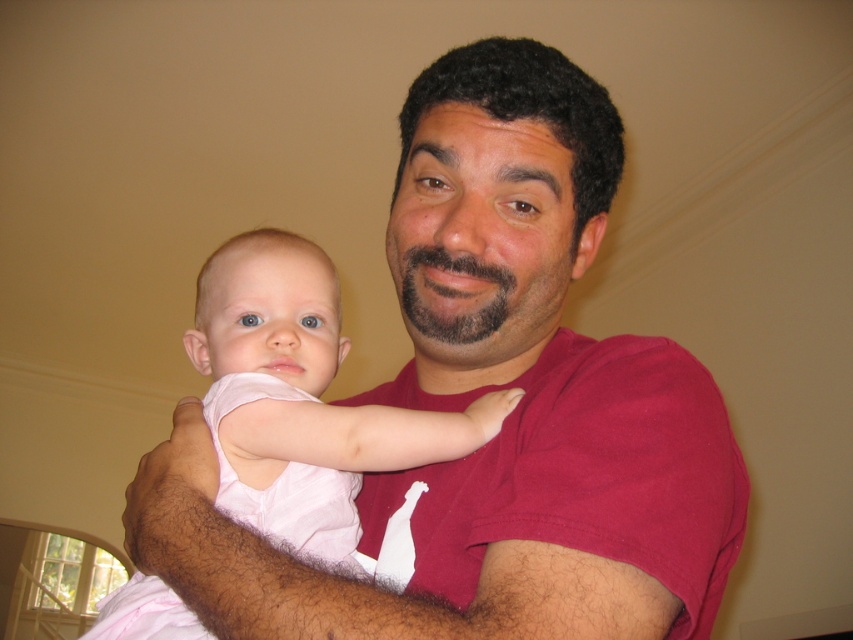
Does pink fabric at center have a greater width compared to pink fabric baby at center?

Indeed, pink fabric at center has a greater width compared to pink fabric baby at center.

Can you confirm if pink fabric at center is bigger than pink fabric baby at center?

Correct, pink fabric at center is larger in size than pink fabric baby at center.

Is point (463, 522) more distant than point (433, 422)?

No.

Where is `pink fabric at center`? pink fabric at center is located at coordinates (482, 502).

Does point (456, 154) come in front of point (265, 589)?

No, (456, 154) is behind (265, 589).

Can you confirm if matte red shirt at center is taller than pink fabric at center?

Yes, matte red shirt at center is taller than pink fabric at center.

Which is behind, point (392, 385) or point (500, 518)?

The point (392, 385) is more distant.

You are a GUI agent. You are given a task and a screenshot of the screen. Output one action in this format:
    pyautogui.click(x=<x>, y=<y>)
    Task: Click on the matte red shirt at center
    The height and width of the screenshot is (640, 853).
    Given the screenshot: What is the action you would take?
    pyautogui.click(x=506, y=417)

Who is shorter, matte red shirt at center or pink fabric baby at center?

pink fabric baby at center

Who is more forward, (309, 572) or (322, 541)?

Point (309, 572)

Between point (706, 385) and point (244, 355), which one is positioned behind?

The point (244, 355) is more distant.

At what (x,y) coordinates should I click in order to perform the action: click on matte red shirt at center. Please return your answer as a coordinate pair (x, y). Looking at the image, I should click on (506, 417).